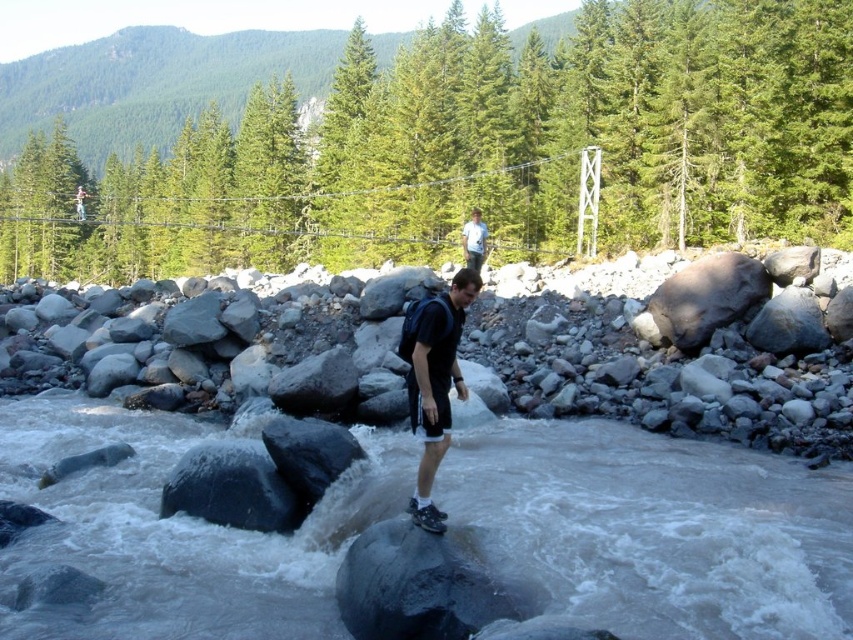
Question: Estimate the real-world distances between objects in this image. Which object is farther from the matte black backpack at center?

Choices:
 (A) black matte shorts at center
 (B) gray smooth rock at center
 (C) gray rock at center

Answer: (A)

Question: Which of the following is the closest to the observer?

Choices:
 (A) (720, 326)
 (B) (82, 516)
 (C) (432, 445)

Answer: (C)

Question: Can you confirm if gray smooth rock at center is smaller than gray rock at center?

Choices:
 (A) no
 (B) yes

Answer: (B)

Question: Is gray rock at center closer to the viewer compared to matte black backpack at center?

Choices:
 (A) yes
 (B) no

Answer: (A)

Question: Can you confirm if black matte shorts at center is positioned below white cotton shirt at upper center?

Choices:
 (A) no
 (B) yes

Answer: (B)

Question: Estimate the real-world distances between objects in this image. Which object is farther from the gray smooth rock at center?

Choices:
 (A) gray rock at center
 (B) black matte shorts at center
 (C) matte black backpack at center

Answer: (C)